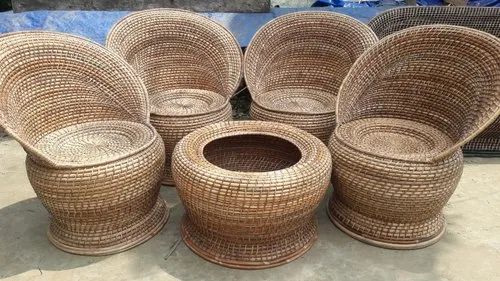
What are the coordinates of `second from right chair back` in the screenshot? It's located at (313, 51).